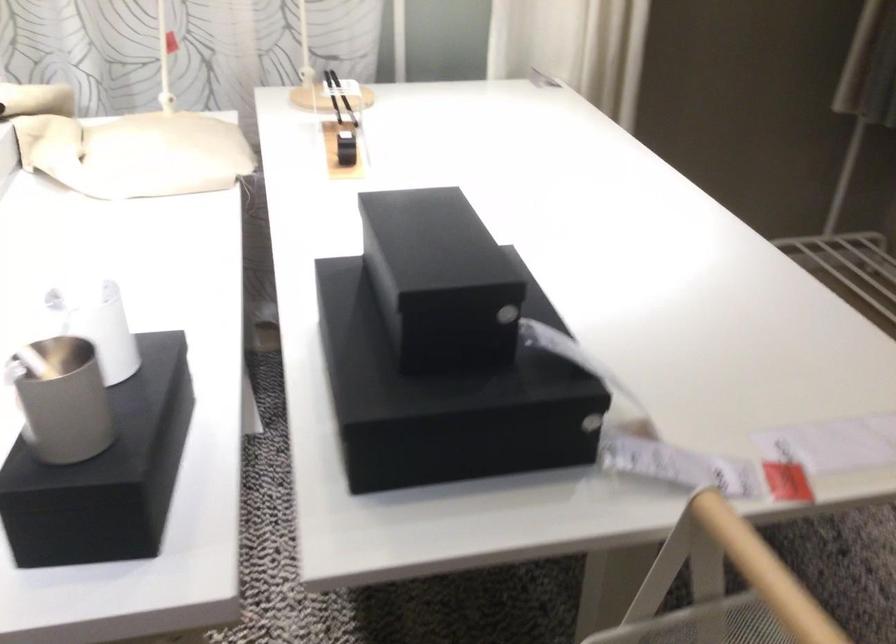
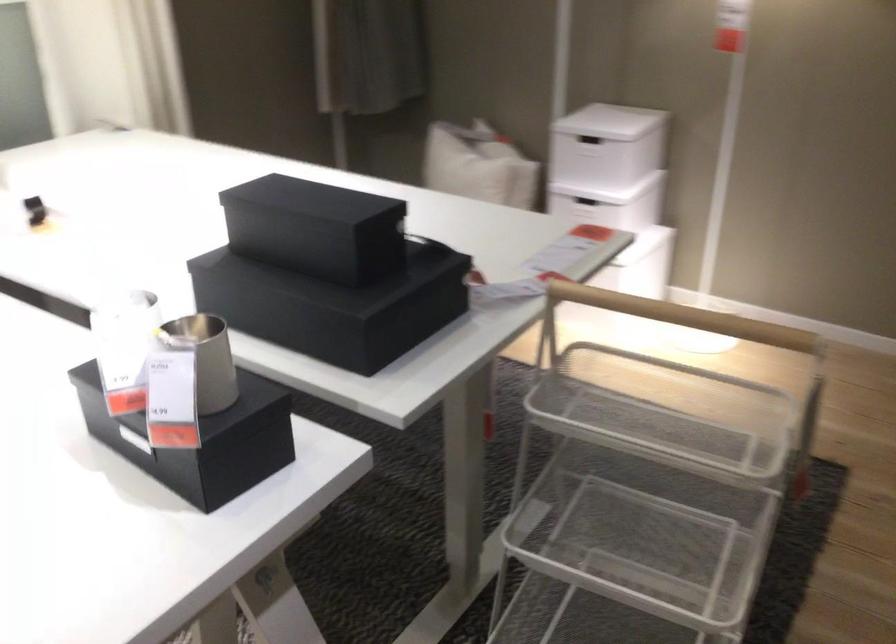
The point at (393, 275) is marked in the first image. Where is the corresponding point in the second image?

(315, 228)